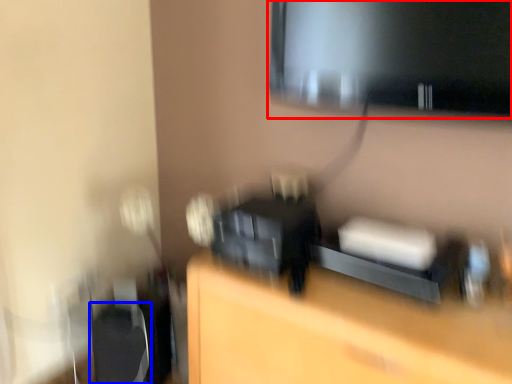
Question: Which object is further to the camera taking this photo, computer monitor (highlighted by a red box) or swivel chair (highlighted by a blue box)?

Choices:
 (A) computer monitor
 (B) swivel chair

Answer: (B)